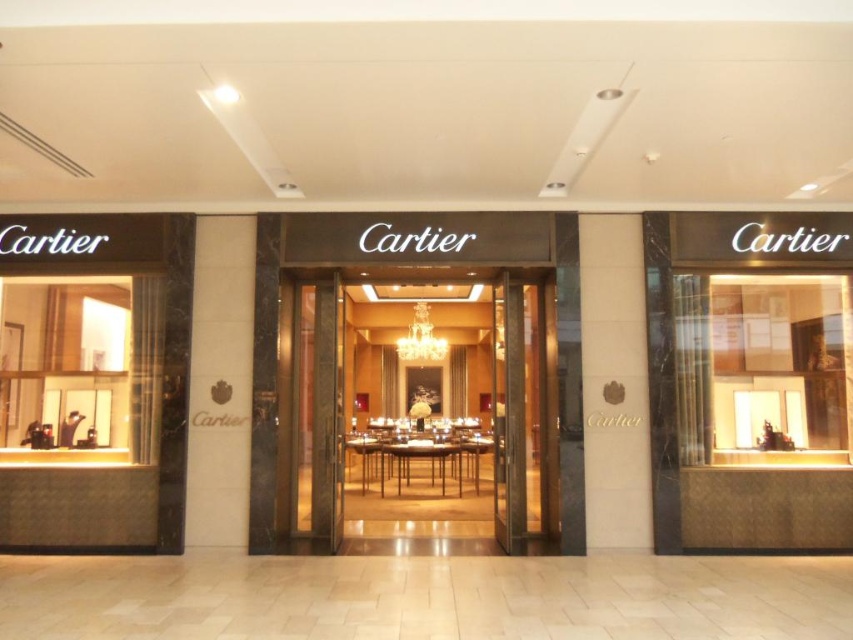
Between gold polished wood entrance at center and transparent glass door at center, which one has less height?

transparent glass door at center is shorter.

Does gold polished wood entrance at center have a lesser height compared to transparent glass door at center?

No.

Where is `gold polished wood entrance at center`? This screenshot has height=640, width=853. gold polished wood entrance at center is located at coordinates (421, 413).